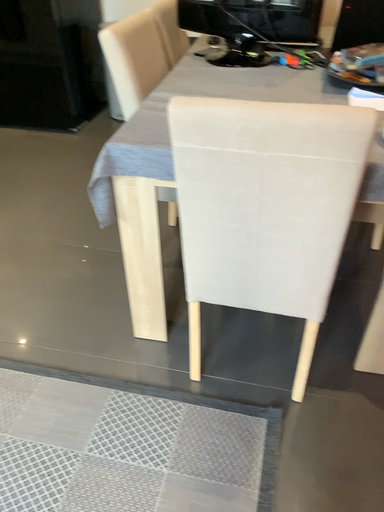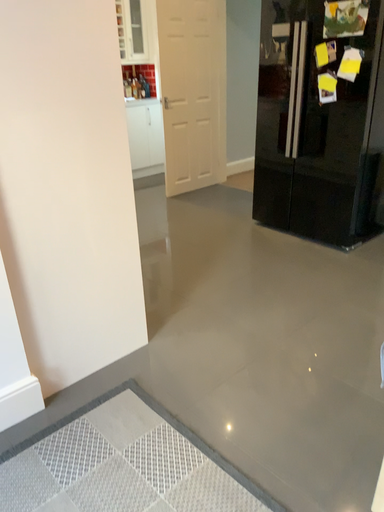
Question: How did the camera likely rotate when shooting the video?

Choices:
 (A) rotated upward
 (B) rotated downward

Answer: (A)